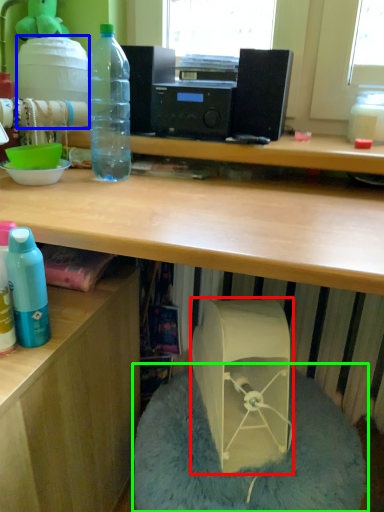
Question: Estimate the real-world distances between objects in this image. Which object is closer to wide (highlighted by a red box), water cooler (highlighted by a blue box) or bean bag chair (highlighted by a green box)?

Choices:
 (A) water cooler
 (B) bean bag chair

Answer: (B)